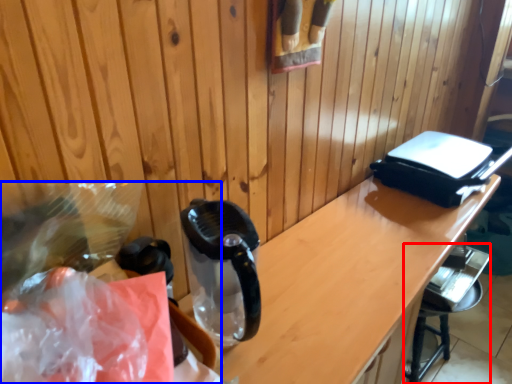
Question: Among these objects, which one is nearest to the camera, bar stool (highlighted by a red box) or waste (highlighted by a blue box)?

Choices:
 (A) bar stool
 (B) waste

Answer: (B)